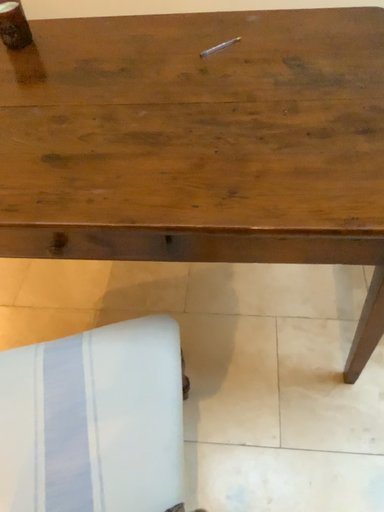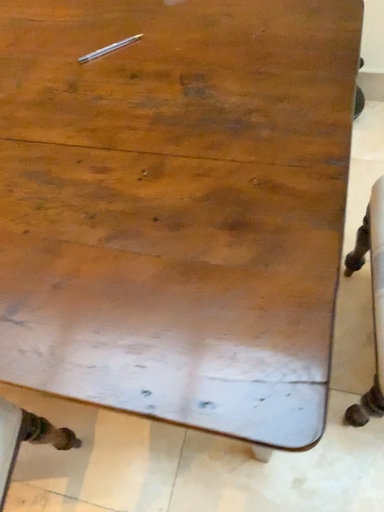
Question: Which way did the camera rotate in the video?

Choices:
 (A) rotated left
 (B) rotated right

Answer: (A)